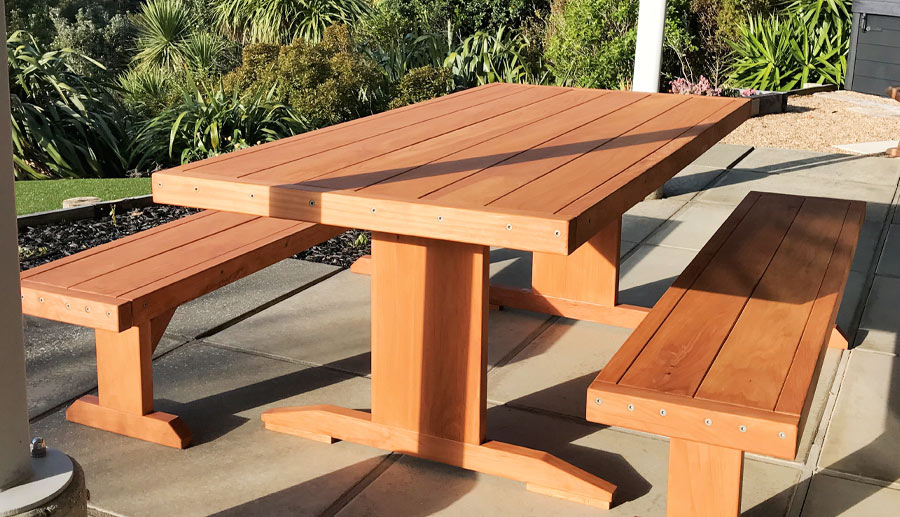
I want to click on green plants, so click(783, 48), click(821, 43), click(446, 52), click(220, 121), click(50, 92), click(146, 101), click(271, 29).